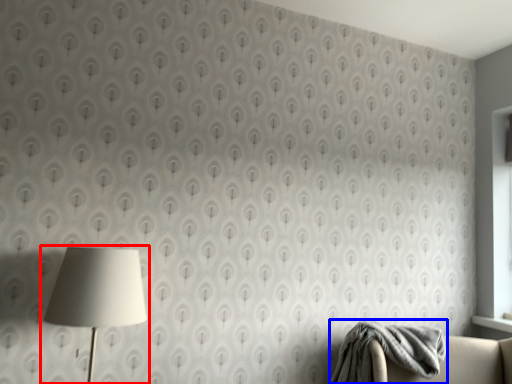
Question: Which object is closer to the camera taking this photo, lamp (highlighted by a red box) or blanket (highlighted by a blue box)?

Choices:
 (A) lamp
 (B) blanket

Answer: (A)